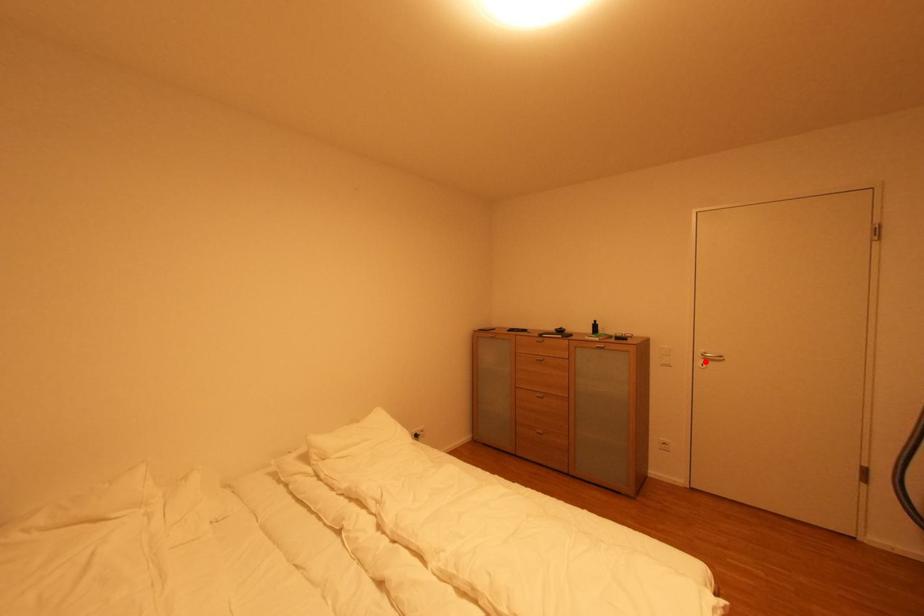
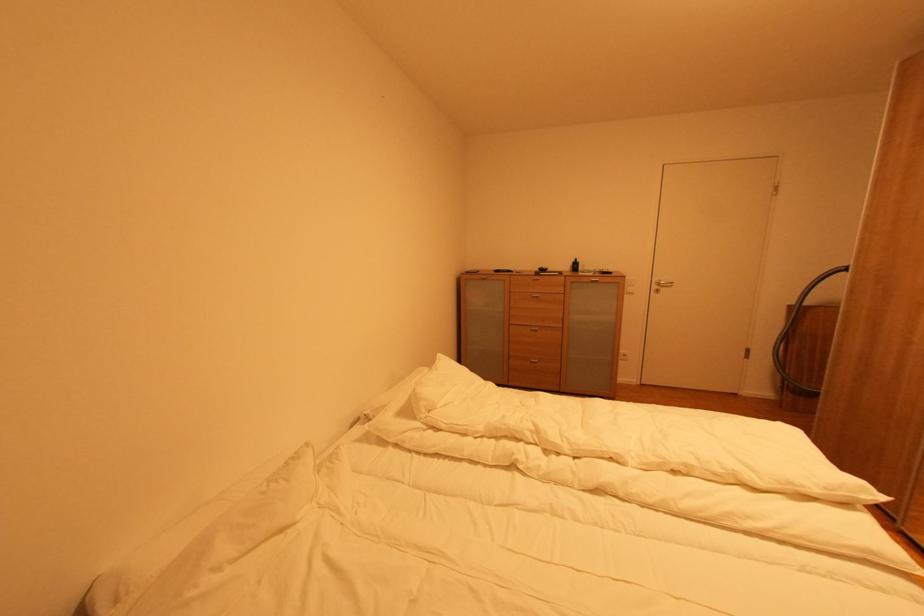
Find the pixel in the second image that matches the highlighted location in the first image.

(661, 289)